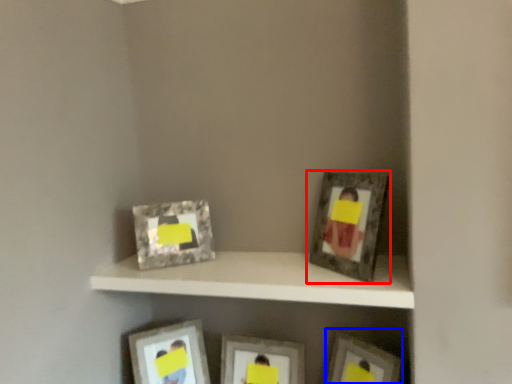
Question: Which object appears closest to the camera in this image, picture frame (highlighted by a red box) or picture frame (highlighted by a blue box)?

Choices:
 (A) picture frame
 (B) picture frame

Answer: (A)